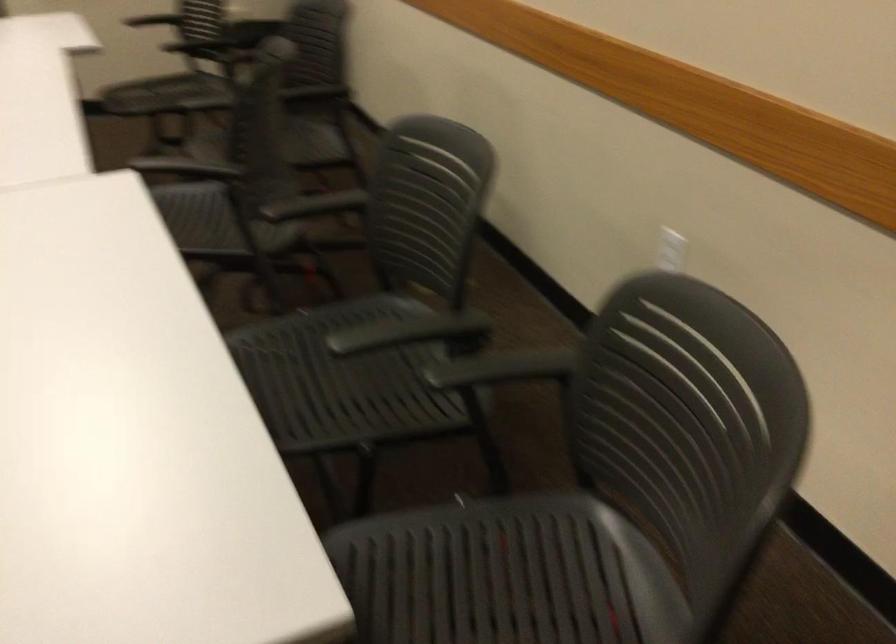
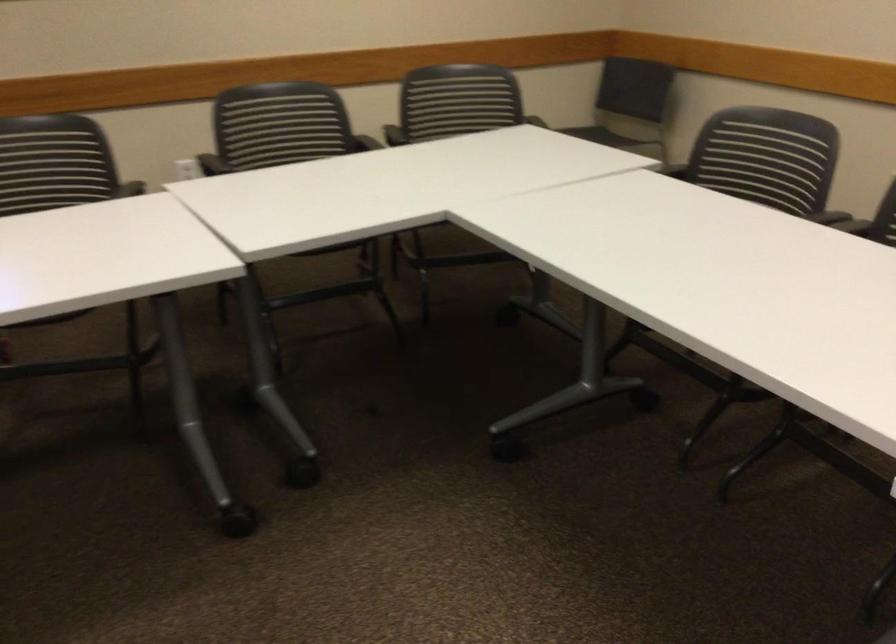
Locate, in the second image, the point that corresponds to pixel 392 218 in the first image.

(211, 164)